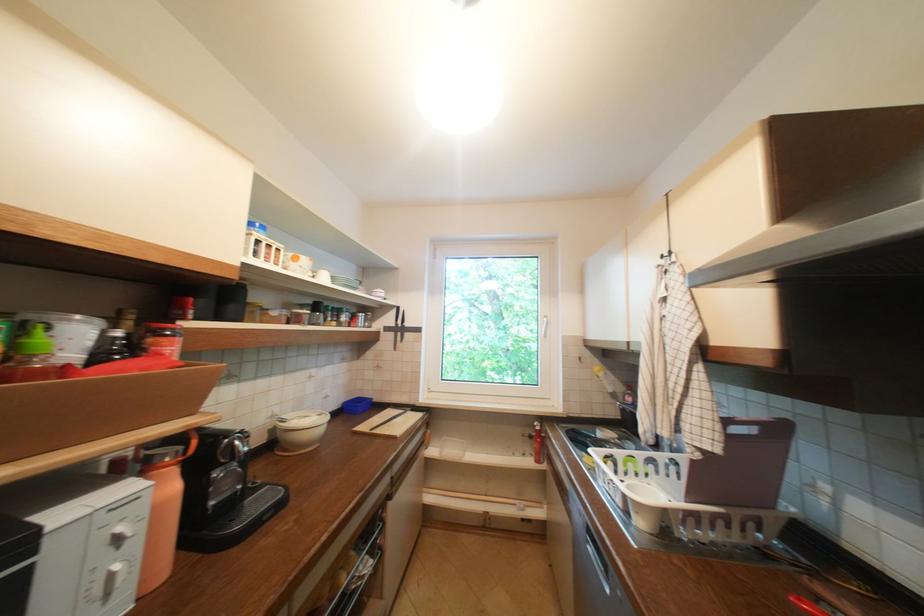
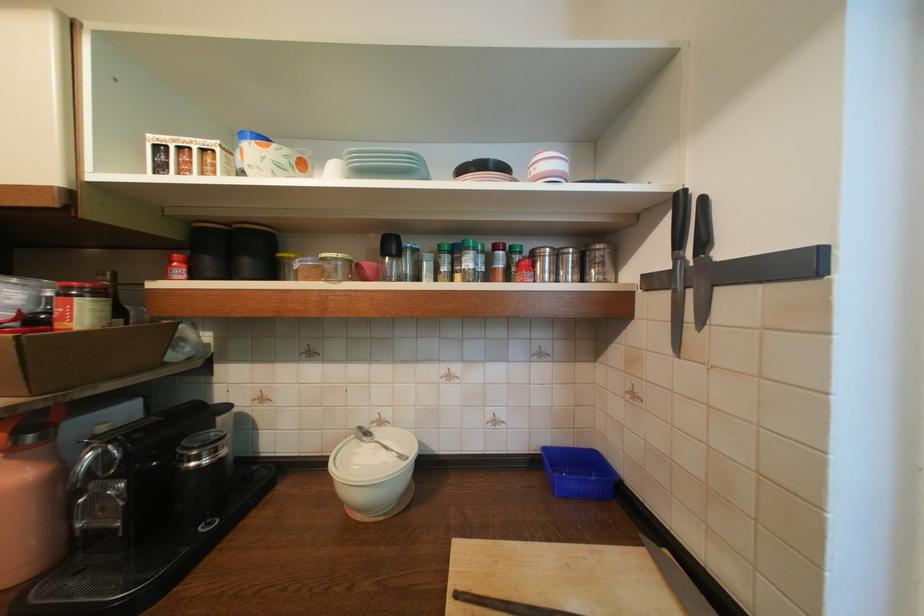
Locate, in the second image, the point that corresponds to (371,317) in the first image.

(565, 256)